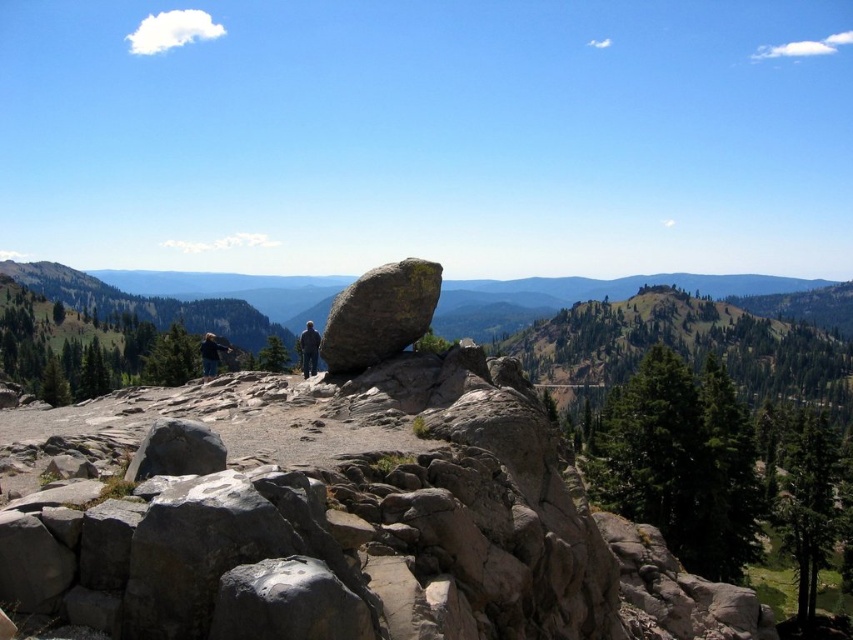
Can you confirm if dark gray fabric pants at center is bigger than dark blue jeans at center?

Indeed, dark gray fabric pants at center has a larger size compared to dark blue jeans at center.

Between dark gray fabric pants at center and dark blue jeans at center, which one is positioned higher?

dark gray fabric pants at center

I want to click on dark gray fabric pants at center, so (308, 349).

Identify the location of dark gray fabric pants at center. (308, 349).

Between smooth gray rock at center and dark blue jeans at center, which one has less height?

dark blue jeans at center is shorter.

In order to click on smooth gray rock at center in this screenshot , I will do `click(379, 314)`.

Which is in front, point (428, 272) or point (213, 348)?

Point (428, 272) is in front.

At what (x,y) coordinates should I click in order to perform the action: click on smooth gray rock at center. Please return your answer as a coordinate pair (x, y). This screenshot has height=640, width=853. Looking at the image, I should click on (379, 314).

Which of these two, smooth gray rock at center or dark gray fabric pants at center, stands shorter?

smooth gray rock at center is shorter.

Identify the location of smooth gray rock at center. The image size is (853, 640). (379, 314).